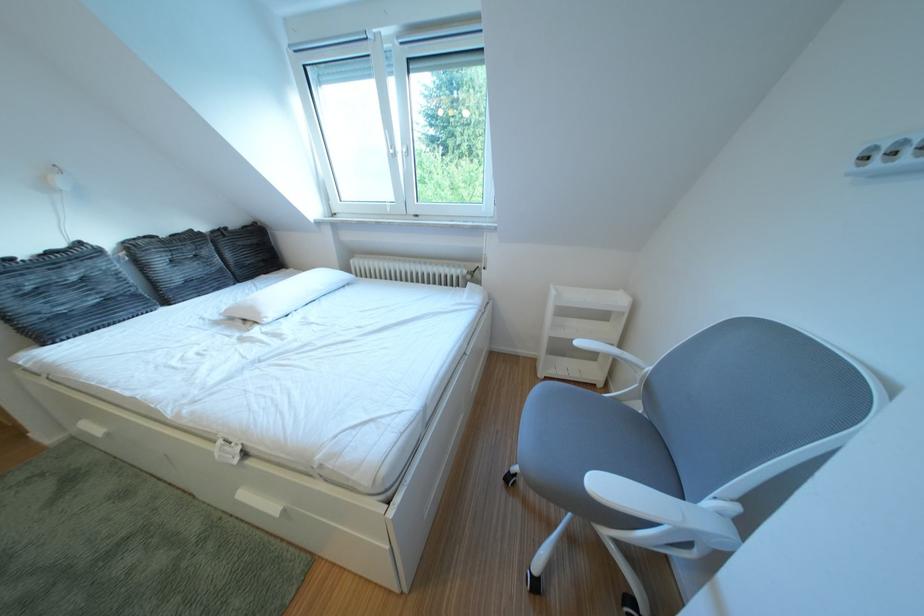
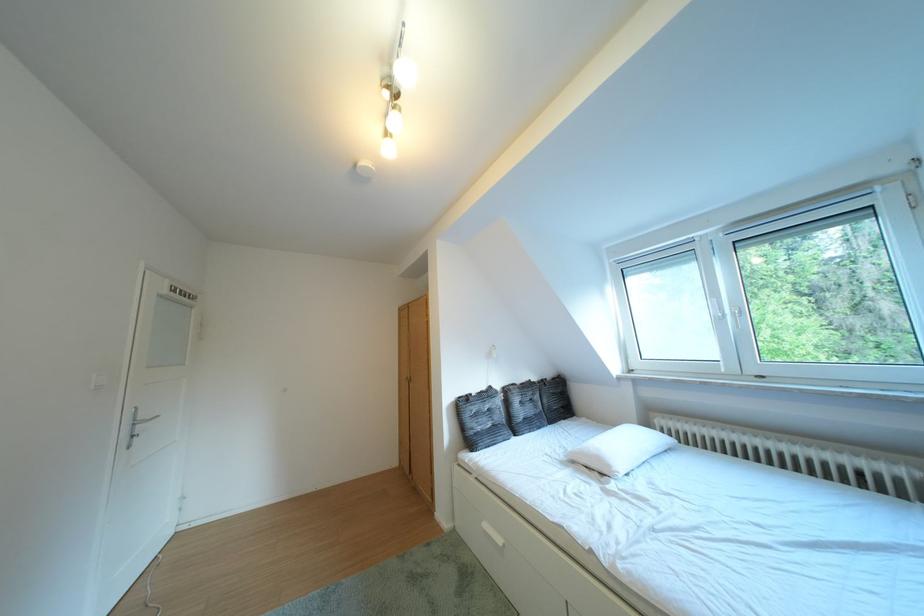
Question: I am providing you with two images of the same scene from different viewpoints. Please identify which objects are invisible in image2.

Choices:
 (A) dark textured pillow
 (B) white drawer handle
 (C) white light switch
 (D) none of these

Answer: (D)